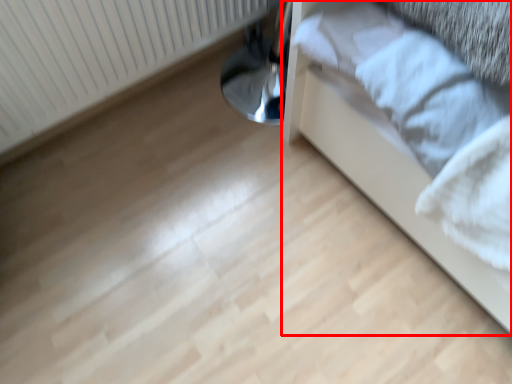
Question: Considering the relative positions of furniture (annotated by the red box) and radiator in the image provided, where is furniture (annotated by the red box) located with respect to the staircase?

Choices:
 (A) right
 (B) left

Answer: (A)